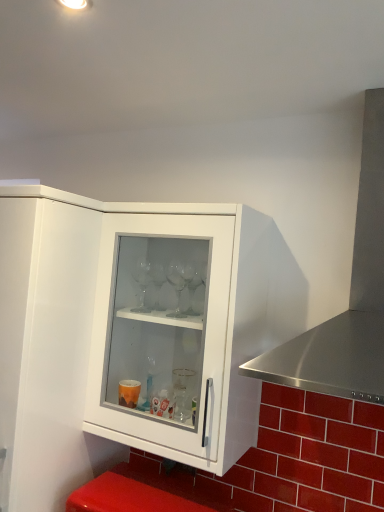
Question: Is white glossy cabinet at upper left smaller than transparent glass cabinet at center?

Choices:
 (A) no
 (B) yes

Answer: (A)

Question: Could transparent glass cabinet at center be considered to be inside white glossy cabinet at upper left?

Choices:
 (A) yes
 (B) no

Answer: (B)

Question: From a real-world perspective, is white glossy cabinet at upper left physically below transparent glass cabinet at center?

Choices:
 (A) no
 (B) yes

Answer: (B)

Question: Is white glossy cabinet at upper left with transparent glass cabinet at center?

Choices:
 (A) yes
 (B) no

Answer: (B)

Question: From the image's perspective, is white glossy cabinet at upper left under transparent glass cabinet at center?

Choices:
 (A) yes
 (B) no

Answer: (A)

Question: Can you confirm if white glossy cabinet at upper left is thinner than transparent glass cabinet at center?

Choices:
 (A) no
 (B) yes

Answer: (A)

Question: Is transparent glass cabinet at center thinner than stainless steel exhaust hood at right?

Choices:
 (A) no
 (B) yes

Answer: (B)

Question: Considering the relative sizes of transparent glass cabinet at center and stainless steel exhaust hood at right in the image provided, is transparent glass cabinet at center wider than stainless steel exhaust hood at right?

Choices:
 (A) no
 (B) yes

Answer: (A)

Question: Does transparent glass cabinet at center have a larger size compared to stainless steel exhaust hood at right?

Choices:
 (A) no
 (B) yes

Answer: (A)

Question: Is transparent glass cabinet at center positioned with its back to stainless steel exhaust hood at right?

Choices:
 (A) yes
 (B) no

Answer: (B)

Question: From the image's perspective, would you say transparent glass cabinet at center is positioned over stainless steel exhaust hood at right?

Choices:
 (A) no
 (B) yes

Answer: (A)

Question: Can you confirm if transparent glass cabinet at center is shorter than stainless steel exhaust hood at right?

Choices:
 (A) no
 (B) yes

Answer: (A)

Question: Can you confirm if transparent glass cabinet at center is bigger than white glossy cabinet at upper left?

Choices:
 (A) no
 (B) yes

Answer: (A)